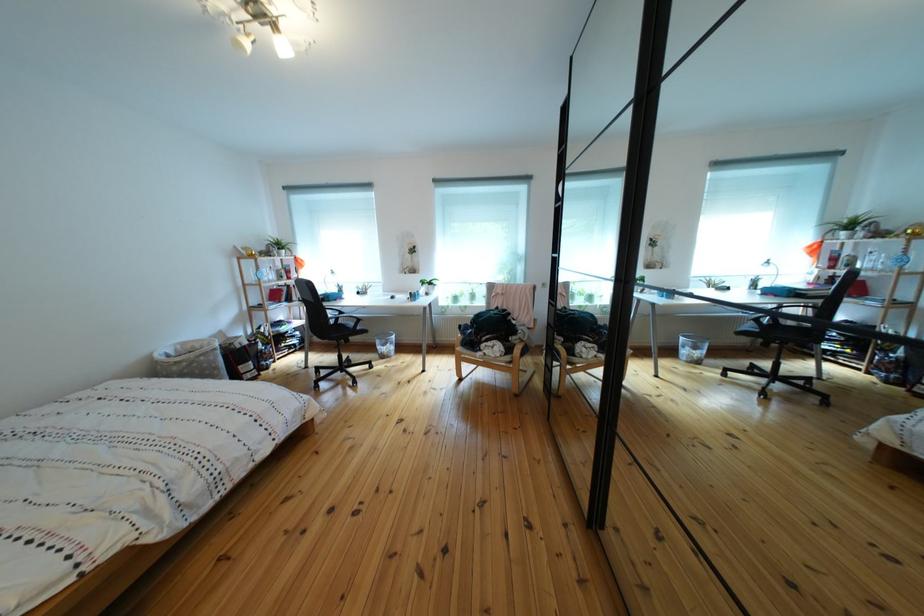
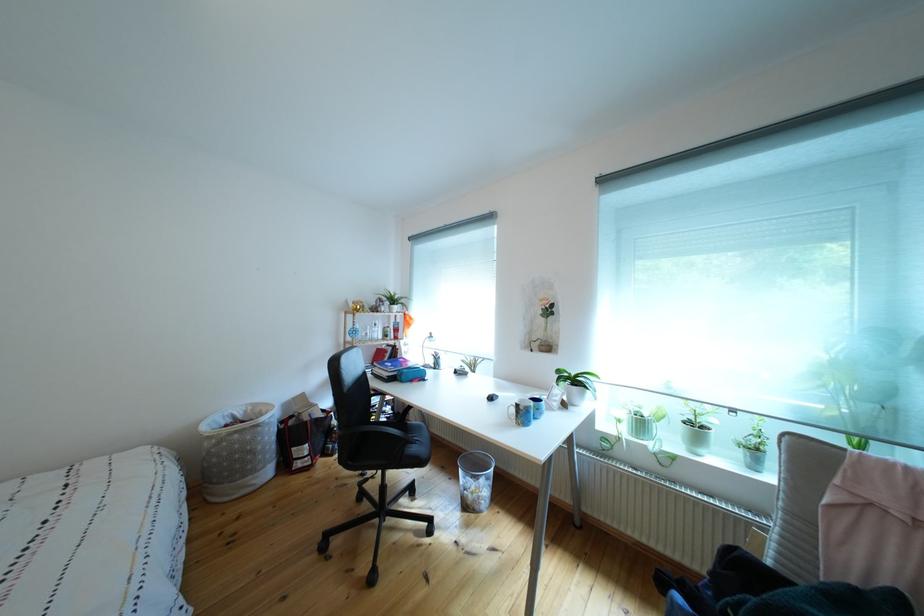
Where in the second image is the point corresponding to point (282, 286) from the first image?

(383, 345)